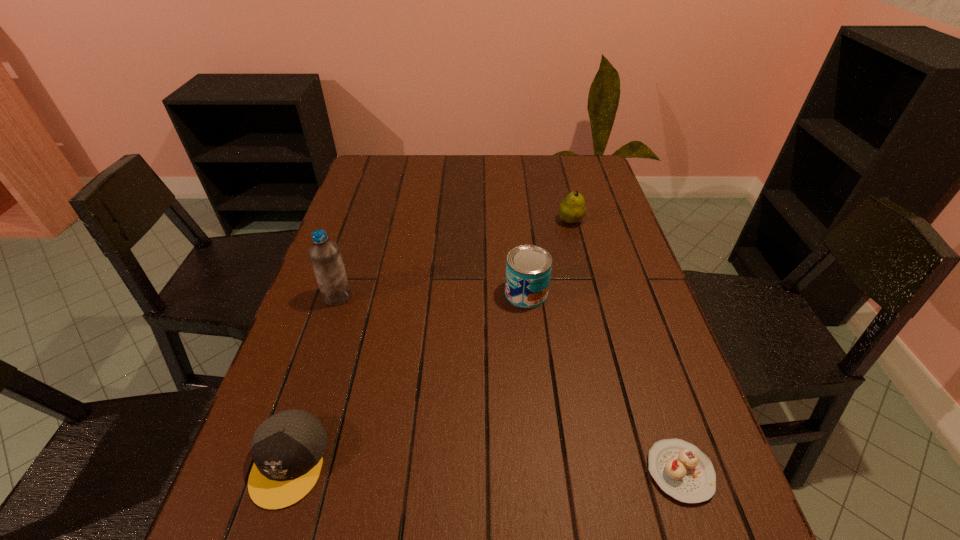
Locate an element on the screen. free space in the image that satisfies the following two spatial constraints: 1. on the front-facing side of the cap; 2. on the right side of the cupcake is located at coordinates (286, 471).